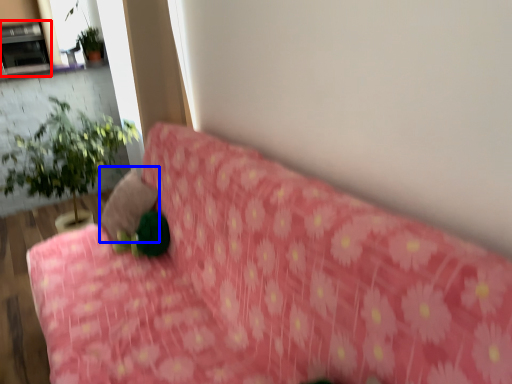
Question: Among these objects, which one is nearest to the camera, fireplace (highlighted by a red box) or pillow (highlighted by a blue box)?

Choices:
 (A) fireplace
 (B) pillow

Answer: (B)